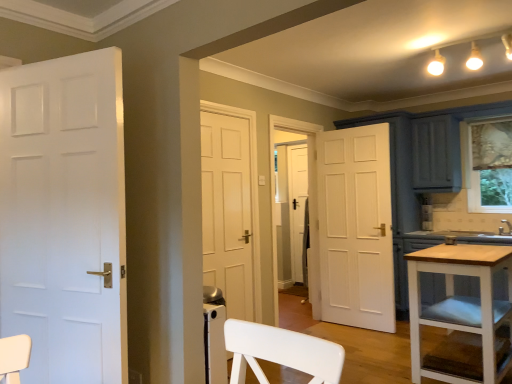
Question: Would you say white matte door at left is a long distance from white wood table at lower right?

Choices:
 (A) yes
 (B) no

Answer: (A)

Question: Is white matte door at left positioned with its back to white wood table at lower right?

Choices:
 (A) yes
 (B) no

Answer: (B)

Question: Considering the relative sizes of white matte door at left and white wood table at lower right in the image provided, is white matte door at left thinner than white wood table at lower right?

Choices:
 (A) yes
 (B) no

Answer: (A)

Question: Would you say white matte door at left is outside white wood table at lower right?

Choices:
 (A) no
 (B) yes

Answer: (B)

Question: Does white matte door at left have a lesser height compared to white wood table at lower right?

Choices:
 (A) no
 (B) yes

Answer: (A)

Question: Considering the relative sizes of white matte door at left and white wood table at lower right in the image provided, is white matte door at left smaller than white wood table at lower right?

Choices:
 (A) yes
 (B) no

Answer: (A)

Question: From a real-world perspective, is white wood table at lower right under white matte door at left?

Choices:
 (A) yes
 (B) no

Answer: (A)

Question: Is the position of white wood table at lower right less distant than that of white matte door at left?

Choices:
 (A) no
 (B) yes

Answer: (A)

Question: Could you tell me if white wood table at lower right is turned towards white matte door at left?

Choices:
 (A) yes
 (B) no

Answer: (B)

Question: Is white wood table at lower right surrounding white matte door at left?

Choices:
 (A) yes
 (B) no

Answer: (B)

Question: From the image's perspective, is white wood table at lower right located above white matte door at left?

Choices:
 (A) yes
 (B) no

Answer: (B)

Question: Is white wood table at lower right located outside white matte door at left?

Choices:
 (A) no
 (B) yes

Answer: (B)

Question: Is white matte door at left bigger or smaller than white wood table at lower right?

Choices:
 (A) big
 (B) small

Answer: (B)